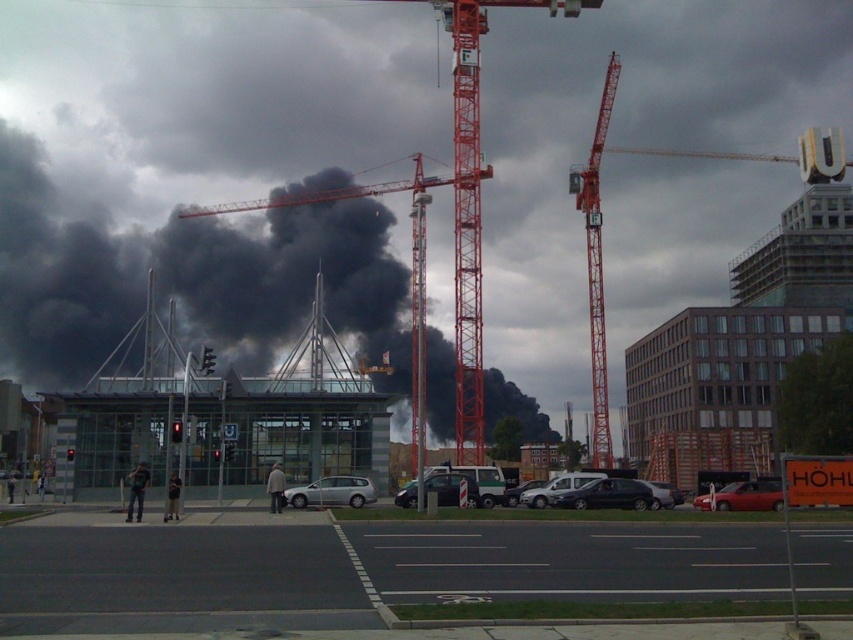
Who is more forward, [82,323] or [421,275]?

Positioned in front is point [421,275].

Can you confirm if black smoke at center is positioned to the right of red metal crane at center?

Indeed, black smoke at center is positioned on the right side of red metal crane at center.

Is point (509, 184) positioned before point (459, 138)?

That is False.

Identify the location of black smoke at center. (186, 150).

Who is lower down, shiny black sedan at center or satin silver van at center?

satin silver van at center

I want to click on shiny black sedan at center, so click(x=607, y=496).

The width and height of the screenshot is (853, 640). Describe the element at coordinates (607, 496) in the screenshot. I see `shiny black sedan at center` at that location.

Find the location of `shiny black sedan at center`. shiny black sedan at center is located at coordinates (607, 496).

Is red metal crane at center further to camera compared to shiny black sedan at center?

No, it is in front of shiny black sedan at center.

Who is more forward, (527, 4) or (564, 500)?

Point (564, 500) is in front.

Find the location of a particular element. red metal crane at center is located at coordinates point(453,202).

Where is `red metal crane at center`? This screenshot has height=640, width=853. red metal crane at center is located at coordinates [x=453, y=202].